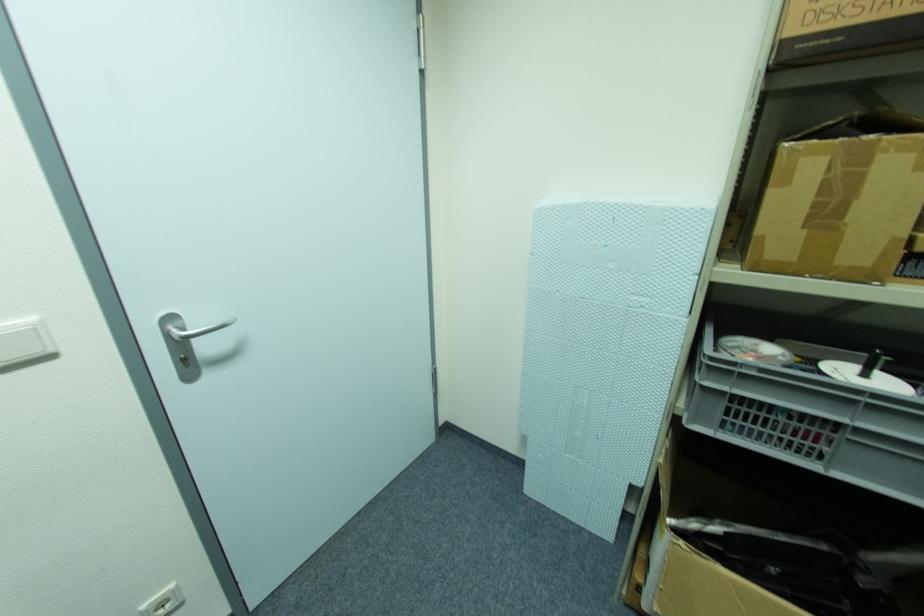
This screenshot has height=616, width=924. In order to click on white light switch in this screenshot , I will do `click(22, 342)`.